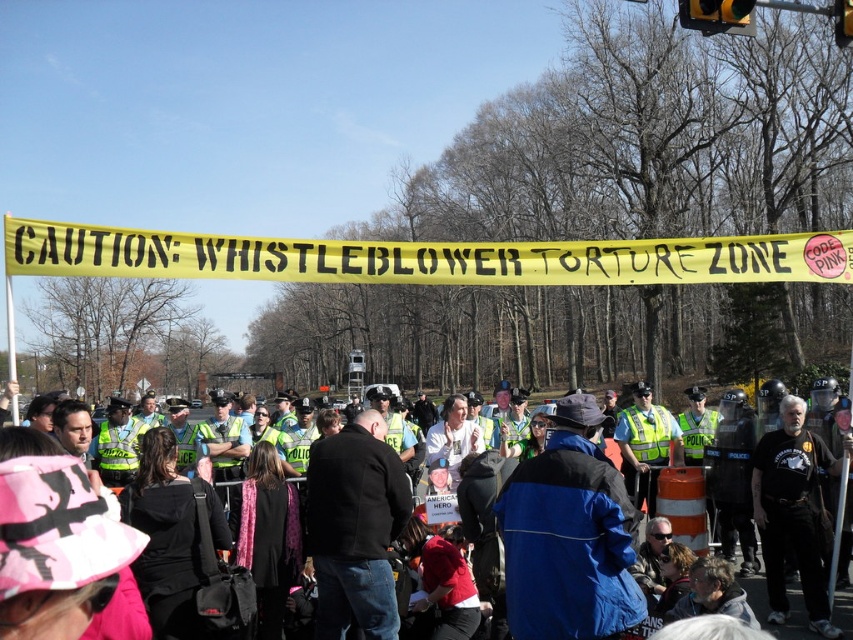
You are a journalist at the protest scene. You see the yellow caution tape at center and the blue fabric jacket at center. Which object is positioned to the right of the other?

The yellow caution tape at center is to the right of the blue fabric jacket at center.

What is located at the coordinates point (569,536)?

The blue fabric jacket at center is located at point (569,536).